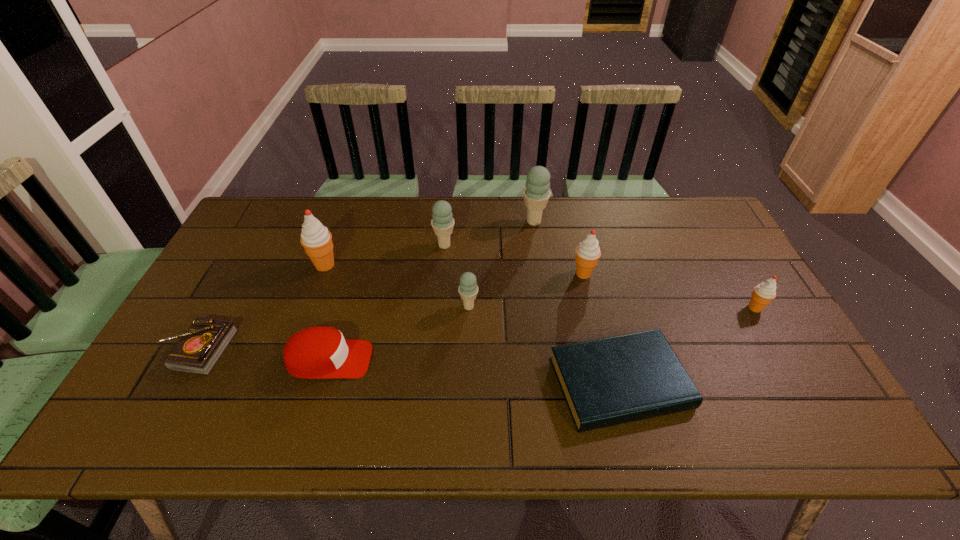
Locate an element on the screen. The image size is (960, 540). red icecream that is the closest to the fifth ice cream from left to right is located at coordinates (765, 292).

Locate which red icecream ranks third in proximity to the red baseball cap. Please provide its 2D coordinates. Your answer should be formatted as a tuple, i.e. [(x, y)], where the tuple contains the x and y coordinates of a point satisfying the conditions above.

[(765, 292)]

Where is `free spot that satisfies the following two spatial constraints: 1. on the front side of the farthest blue ice cream; 2. on the front-facing side of the red baseball cap`? Image resolution: width=960 pixels, height=540 pixels. free spot that satisfies the following two spatial constraints: 1. on the front side of the farthest blue ice cream; 2. on the front-facing side of the red baseball cap is located at coordinates (553, 360).